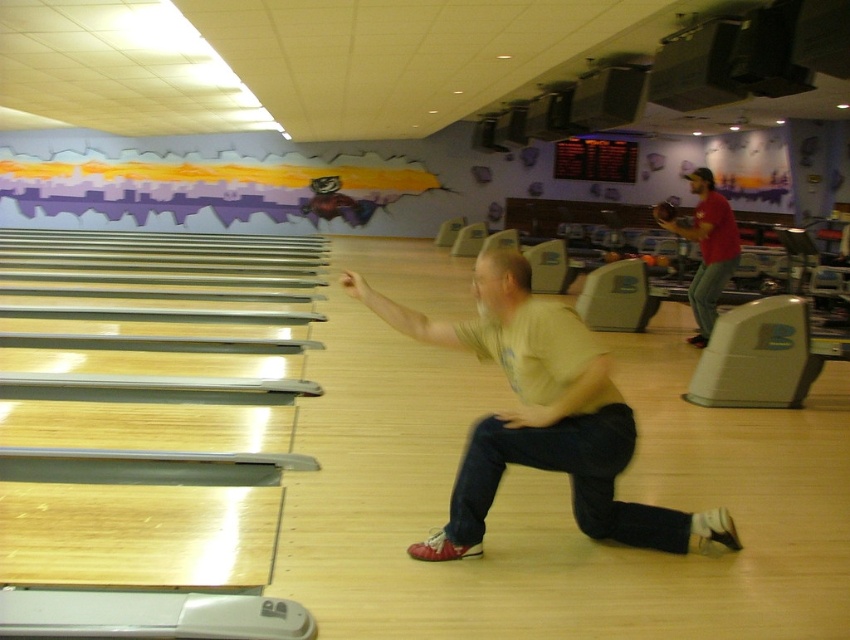
Question: Is the position of light yellow t-shirt at center less distant than that of red cotton shirt at upper right?

Choices:
 (A) no
 (B) yes

Answer: (B)

Question: Which of the following is the farthest from the observer?

Choices:
 (A) (700, 314)
 (B) (527, 387)

Answer: (A)

Question: Where is light yellow t-shirt at center located in relation to red cotton shirt at upper right in the image?

Choices:
 (A) above
 (B) below

Answer: (B)

Question: Which point is closer to the camera?

Choices:
 (A) red cotton shirt at upper right
 (B) light yellow t-shirt at center

Answer: (B)

Question: Can you confirm if light yellow t-shirt at center is positioned above red cotton shirt at upper right?

Choices:
 (A) no
 (B) yes

Answer: (A)